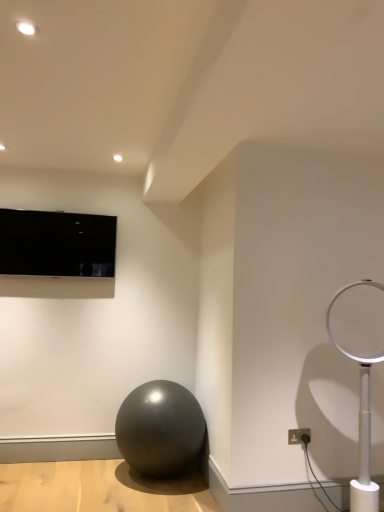
Question: From the image's perspective, is white plastic electric outlet at lower right on top of matte black tv at upper left?

Choices:
 (A) yes
 (B) no

Answer: (B)

Question: Would you say white plastic electric outlet at lower right is a long distance from matte black tv at upper left?

Choices:
 (A) yes
 (B) no

Answer: (A)

Question: Is white plastic electric outlet at lower right aimed at matte black tv at upper left?

Choices:
 (A) no
 (B) yes

Answer: (A)

Question: Is matte black tv at upper left inside white plastic electric outlet at lower right?

Choices:
 (A) yes
 (B) no

Answer: (B)

Question: Does white plastic electric outlet at lower right have a smaller size compared to matte black tv at upper left?

Choices:
 (A) yes
 (B) no

Answer: (A)

Question: Considering the relative positions of white plastic lamp at right and shiny black ball at center in the image provided, is white plastic lamp at right to the left or to the right of shiny black ball at center?

Choices:
 (A) right
 (B) left

Answer: (A)

Question: Is white plastic lamp at right situated inside shiny black ball at center or outside?

Choices:
 (A) outside
 (B) inside

Answer: (A)

Question: Considering the positions of white plastic lamp at right and shiny black ball at center in the image, is white plastic lamp at right bigger or smaller than shiny black ball at center?

Choices:
 (A) big
 (B) small

Answer: (B)

Question: From their relative heights in the image, would you say white plastic lamp at right is taller or shorter than shiny black ball at center?

Choices:
 (A) short
 (B) tall

Answer: (B)

Question: From a real-world perspective, relative to white plastic lamp at right, is white plastic electric outlet at lower right vertically above or below?

Choices:
 (A) above
 (B) below

Answer: (B)

Question: Considering the positions of point (292, 433) and point (337, 325), is point (292, 433) closer or farther from the camera than point (337, 325)?

Choices:
 (A) closer
 (B) farther

Answer: (A)

Question: Looking at the image, does white plastic electric outlet at lower right seem bigger or smaller compared to white plastic lamp at right?

Choices:
 (A) big
 (B) small

Answer: (B)

Question: Considering their positions, is white plastic electric outlet at lower right located in front of or behind white plastic lamp at right?

Choices:
 (A) behind
 (B) front

Answer: (A)

Question: From a real-world perspective, relative to white plastic lamp at right, is matte black tv at upper left vertically above or below?

Choices:
 (A) above
 (B) below

Answer: (A)

Question: Based on their sizes in the image, would you say matte black tv at upper left is bigger or smaller than white plastic lamp at right?

Choices:
 (A) big
 (B) small

Answer: (B)